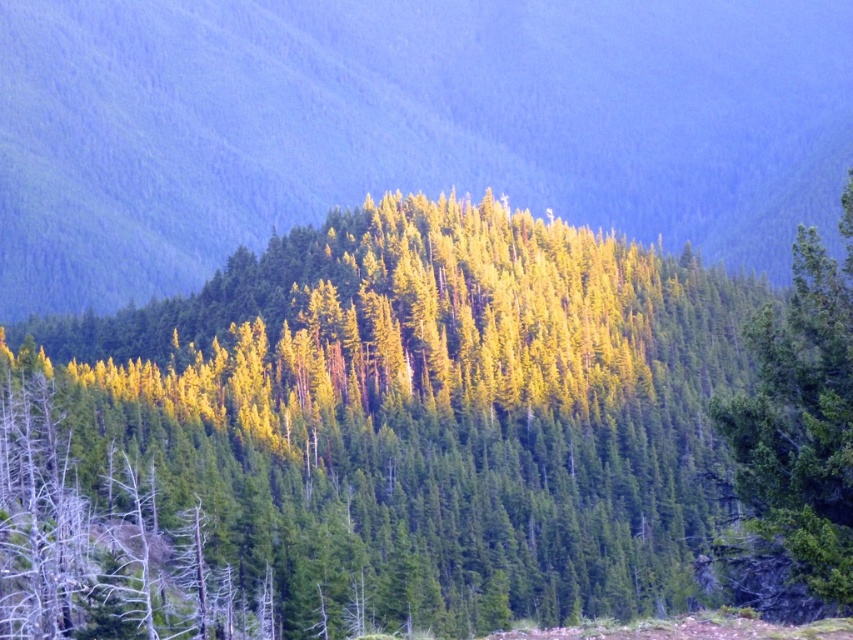
Question: Considering the relative positions of green textured forest at center and green matte tree at right in the image provided, where is green textured forest at center located with respect to green matte tree at right?

Choices:
 (A) above
 (B) below

Answer: (A)

Question: Which of these objects is positioned farthest from the yellow-green foliage at center?

Choices:
 (A) green textured forest at center
 (B) green matte tree at right

Answer: (A)

Question: Can you confirm if green textured forest at center is positioned above green matte tree at right?

Choices:
 (A) no
 (B) yes

Answer: (B)

Question: Estimate the real-world distances between objects in this image. Which object is farther from the green matte tree at right?

Choices:
 (A) green textured forest at center
 (B) yellow-green foliage at center

Answer: (A)

Question: Does yellow-green foliage at center appear on the left side of green textured forest at center?

Choices:
 (A) yes
 (B) no

Answer: (A)

Question: Which object is positioned farthest from the green textured forest at center?

Choices:
 (A) green matte tree at right
 (B) yellow-green foliage at center

Answer: (A)